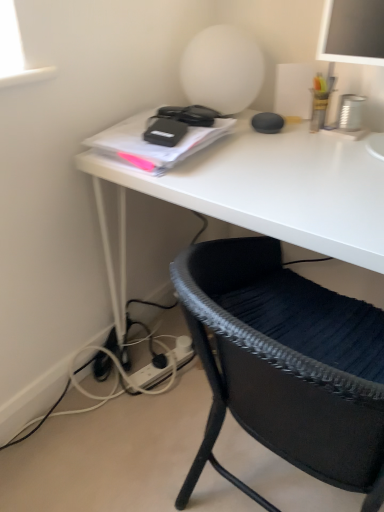
Question: Can you confirm if white plastic plug at lower center is taller than white matte desk at center?

Choices:
 (A) yes
 (B) no

Answer: (B)

Question: Is white plastic plug at lower center further to camera compared to white matte desk at center?

Choices:
 (A) yes
 (B) no

Answer: (A)

Question: Is white plastic plug at lower center not close to white matte desk at center?

Choices:
 (A) yes
 (B) no

Answer: (B)

Question: Does white plastic plug at lower center have a smaller size compared to white matte desk at center?

Choices:
 (A) yes
 (B) no

Answer: (A)

Question: Is white plastic plug at lower center located outside white matte desk at center?

Choices:
 (A) yes
 (B) no

Answer: (B)

Question: From a real-world perspective, is white plastic plug at lower center positioned under white matte desk at center based on gravity?

Choices:
 (A) yes
 (B) no

Answer: (A)

Question: Is white plastic plug at lower center looking in the opposite direction of black woven chair at lower right?

Choices:
 (A) no
 (B) yes

Answer: (A)

Question: Can black woven chair at lower right be found inside white plastic plug at lower center?

Choices:
 (A) yes
 (B) no

Answer: (B)

Question: Is white plastic plug at lower center further to the viewer compared to black woven chair at lower right?

Choices:
 (A) yes
 (B) no

Answer: (A)

Question: Is white plastic plug at lower center positioned in front of black woven chair at lower right?

Choices:
 (A) no
 (B) yes

Answer: (A)

Question: Can you see white plastic plug at lower center touching black woven chair at lower right?

Choices:
 (A) no
 (B) yes

Answer: (A)

Question: Can you confirm if white plastic plug at lower center is taller than black woven chair at lower right?

Choices:
 (A) yes
 (B) no

Answer: (B)

Question: Is white matte desk at center touching black woven chair at lower right?

Choices:
 (A) yes
 (B) no

Answer: (B)